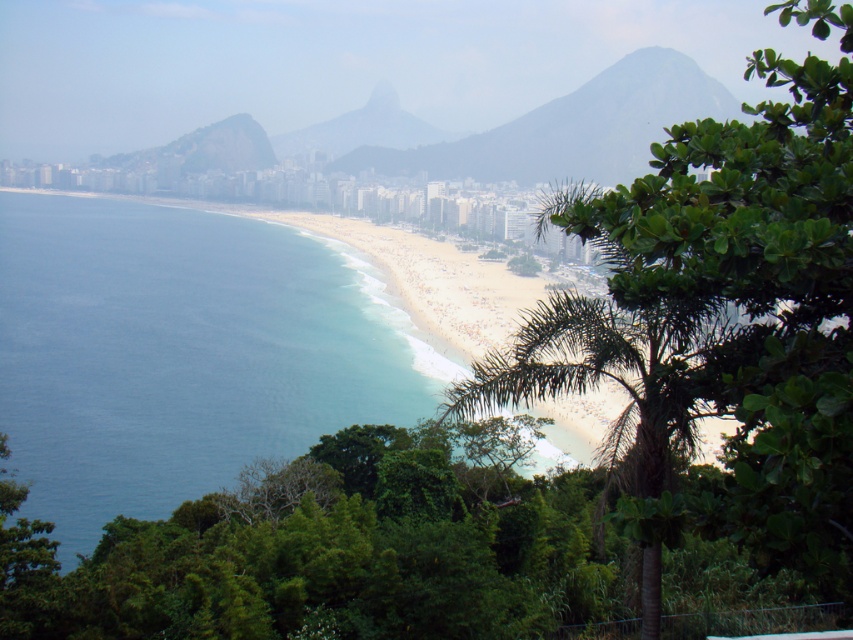
Does point (474, 412) lie behind point (376, 106)?

No, it is not.

Between point (668, 342) and point (300, 131), which one is positioned behind?

Positioned behind is point (300, 131).

Which is in front, point (659, 518) or point (376, 134)?

Point (659, 518) is more forward.

Where is `green leafy palm tree at center`? This screenshot has height=640, width=853. green leafy palm tree at center is located at coordinates (624, 390).

Who is higher up, green leafy palm tree at center or gray rocky mountain at center?

gray rocky mountain at center

Who is taller, green leafy palm tree at center or gray rocky mountain at center?

Standing taller between the two is gray rocky mountain at center.

Who is more forward, (509, 365) or (498, 152)?

Point (509, 365) is in front.

This screenshot has height=640, width=853. I want to click on green leafy palm tree at center, so click(x=624, y=390).

Does blue water at center have a lesser height compared to green leafy palm tree at center?

Incorrect, blue water at center's height does not fall short of green leafy palm tree at center's.

Which is more to the left, blue water at center or green leafy palm tree at center?

blue water at center is more to the left.

Locate an element on the screen. blue water at center is located at coordinates (183, 353).